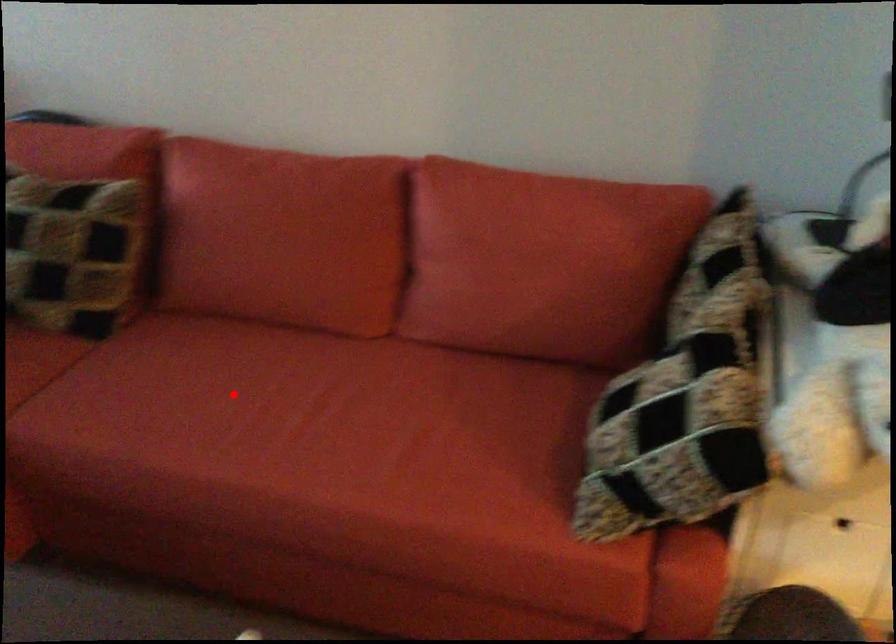
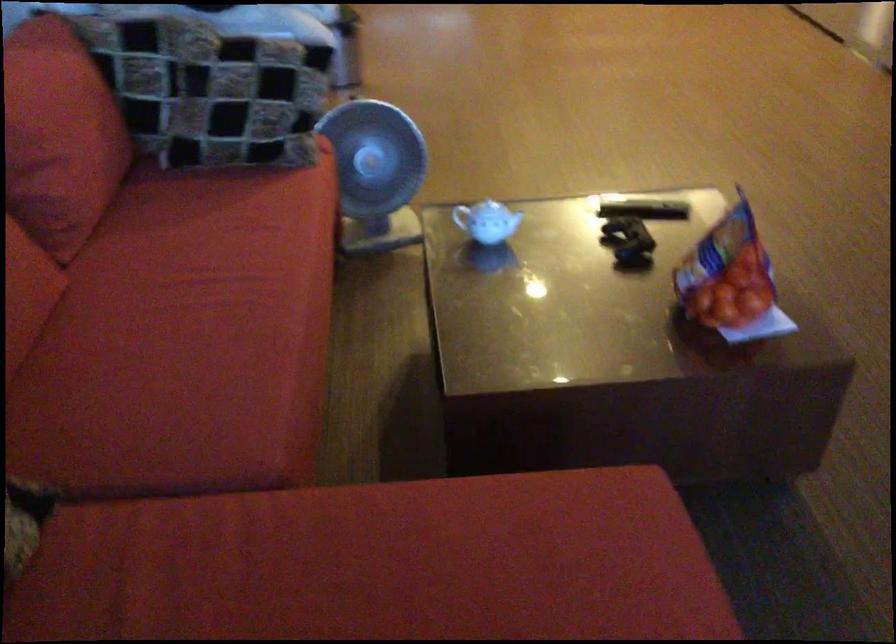
The point at the highlighted location is marked in the first image. Where is the corresponding point in the second image?

(192, 330)